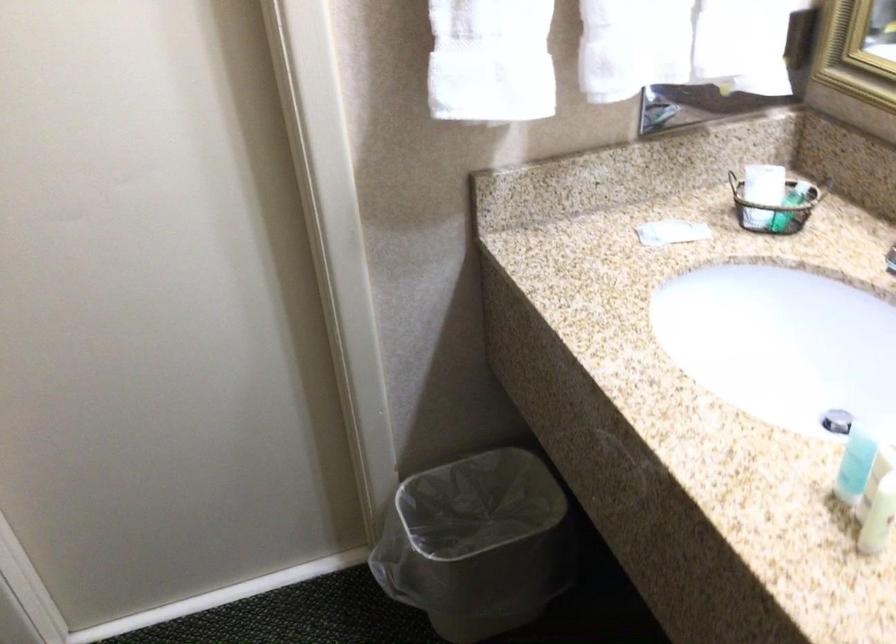
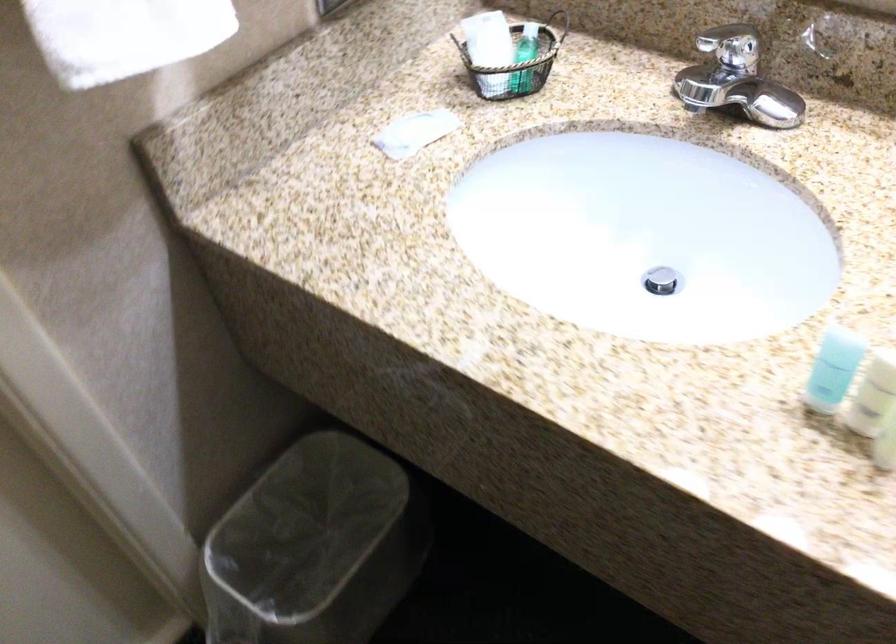
Where in the second image is the point corresponding to (x=476, y=529) from the first image?

(314, 547)